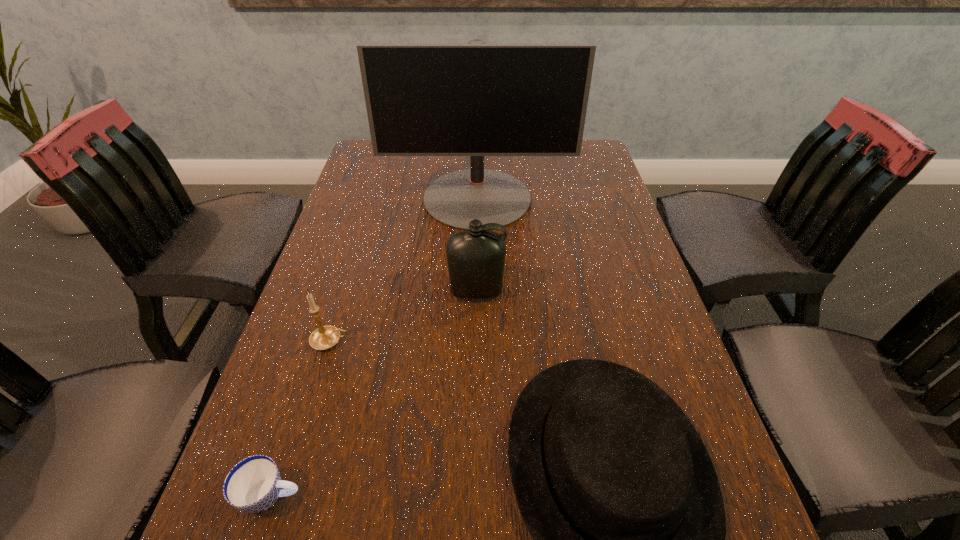
Find the location of a particular element. Image resolution: width=960 pixels, height=540 pixels. vacant space that satisfies the following two spatial constraints: 1. on the screen of the farthest object; 2. on the side of the shortest object with the handle is located at coordinates (475, 495).

Locate an element on the screen. free space that satisfies the following two spatial constraints: 1. on the screen of the computer monitor; 2. on the handle side of the third nearest object is located at coordinates click(x=476, y=341).